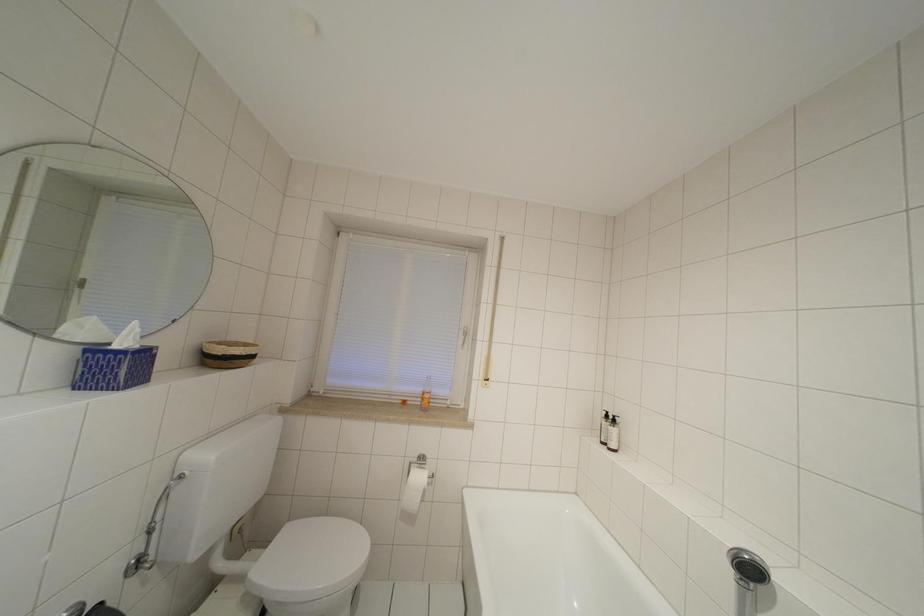
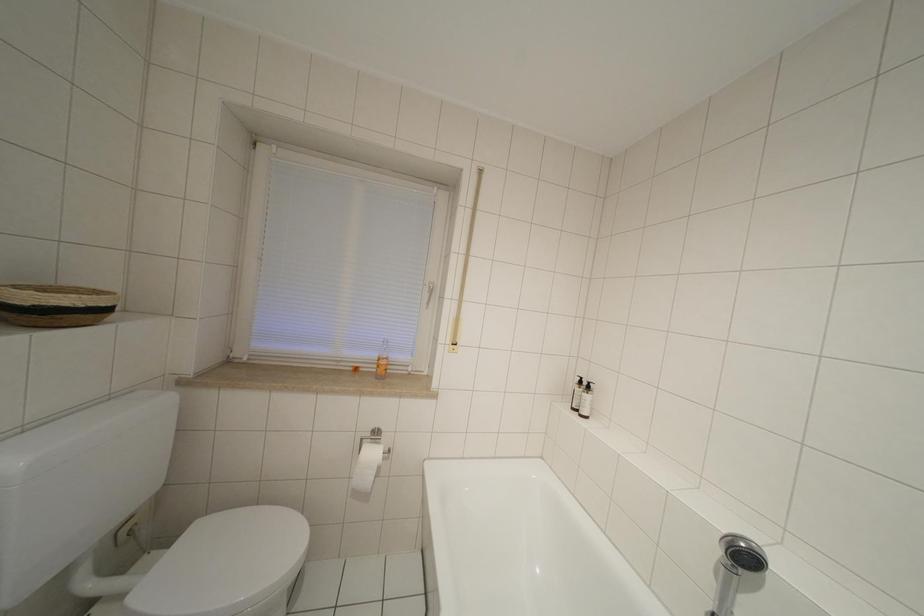
Question: Based on the continuous images, in which direction is the camera rotating? Reply with the corresponding letter.

Choices:
 (A) Left
 (B) Right
 (C) Up
 (D) Down

Answer: (D)